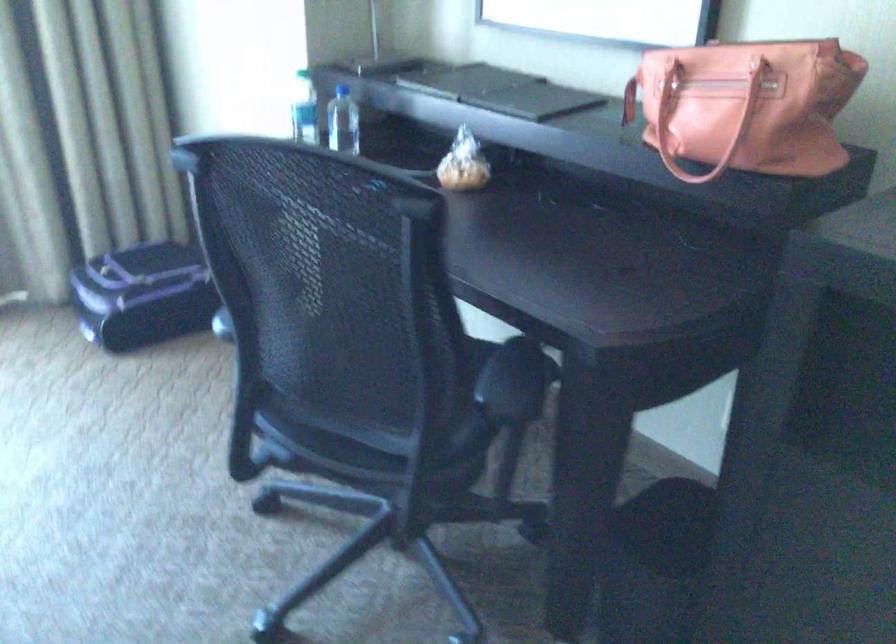
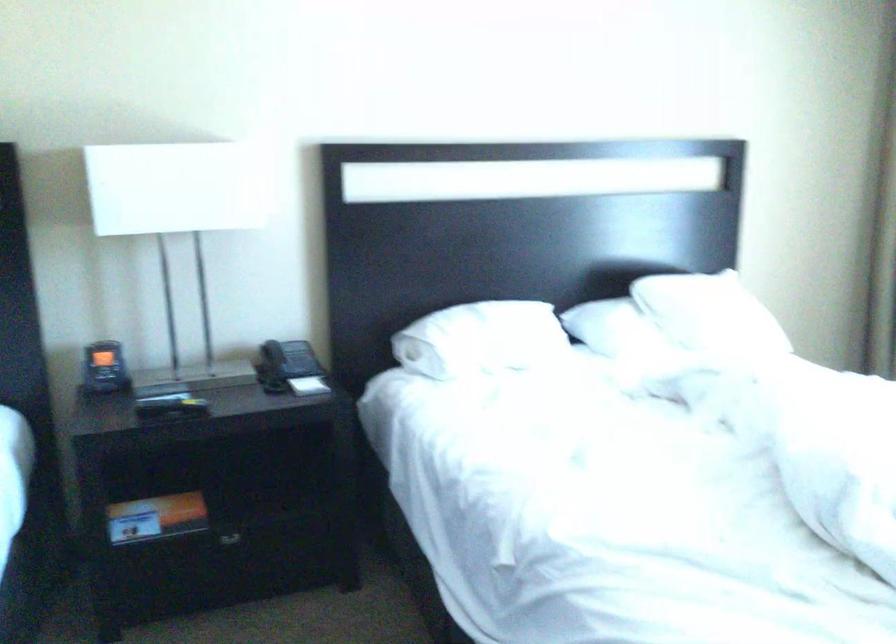
The first image is from the beginning of the video and the second image is from the end. How did the camera likely rotate when shooting the video?

The rotation direction of the camera is left-down.